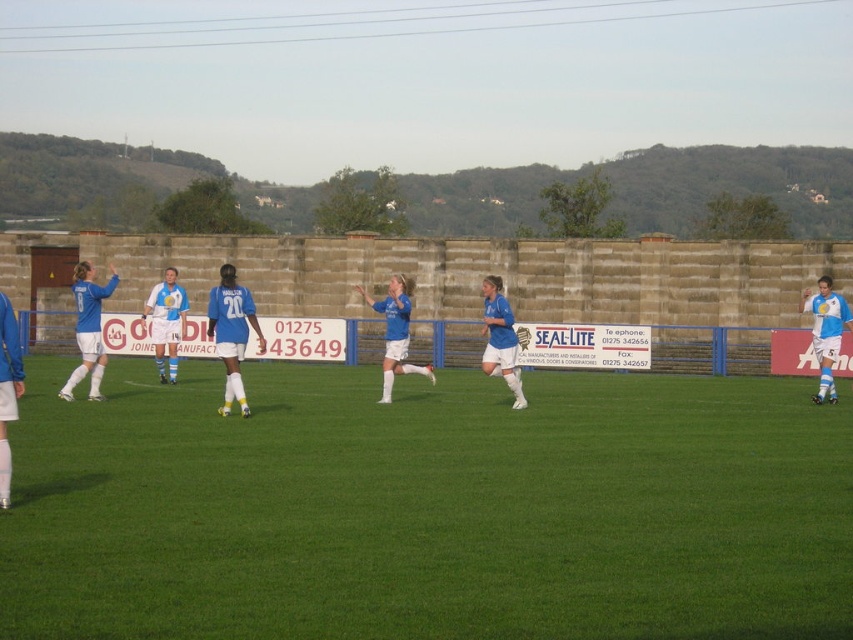
Can you confirm if green grass at center is positioned to the right of white matte soccer ball at right?

No, green grass at center is not to the right of white matte soccer ball at right.

Does point (73, 410) come closer to viewer compared to point (807, 305)?

Yes, it is in front of point (807, 305).

Measure the distance between point (386, 454) and camera.

They are 51.58 feet apart.

The image size is (853, 640). What are the coordinates of `green grass at center` in the screenshot? It's located at (428, 509).

Consider the image. Is green grass at center shorter than blue matte soccer ball at left?

Correct, green grass at center is not as tall as blue matte soccer ball at left.

This screenshot has width=853, height=640. I want to click on green grass at center, so click(428, 509).

Does blue matte soccer ball at left appear on the right side of white matte soccer ball at right?

Incorrect, blue matte soccer ball at left is not on the right side of white matte soccer ball at right.

Consider the image. Is blue matte soccer ball at left shorter than white matte soccer ball at right?

In fact, blue matte soccer ball at left may be taller than white matte soccer ball at right.

Locate an element on the screen. Image resolution: width=853 pixels, height=640 pixels. blue matte soccer ball at left is located at coordinates (88, 330).